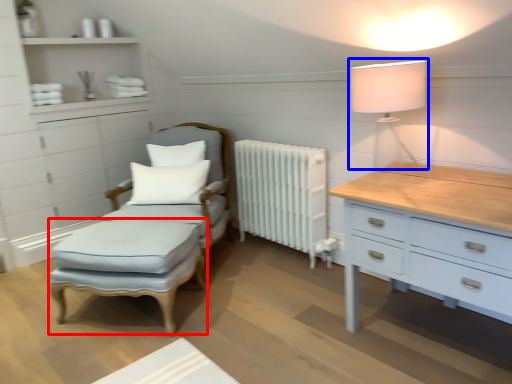
Question: Among these objects, which one is farthest to the camera, footrest (highlighted by a red box) or table lamp (highlighted by a blue box)?

Choices:
 (A) footrest
 (B) table lamp

Answer: (A)